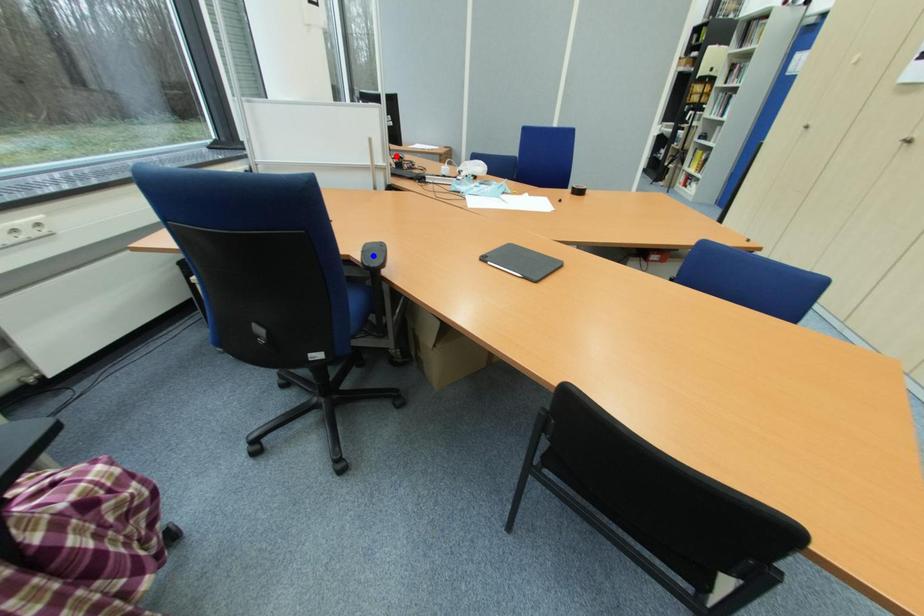
Question: Two points are marked on the image. Which point is closer to the camera?

Choices:
 (A) Blue point is closer.
 (B) Red point is closer.

Answer: (A)